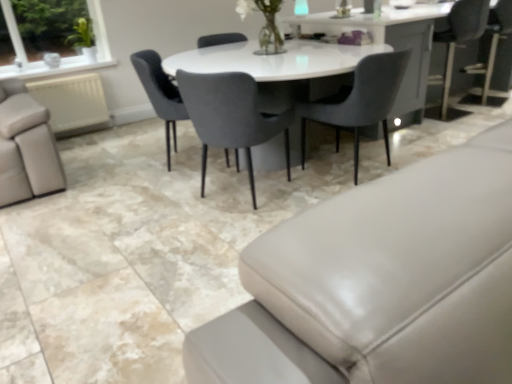
You are a GUI agent. You are given a task and a screenshot of the screen. Output one action in this format:
    pyautogui.click(x=<x>, y=<y>)
    Task: Click on the free space to the left of velvet grey chair at center, acting as the second chair starting from the left
    This screenshot has height=384, width=512.
    Given the screenshot: What is the action you would take?
    pyautogui.click(x=151, y=204)